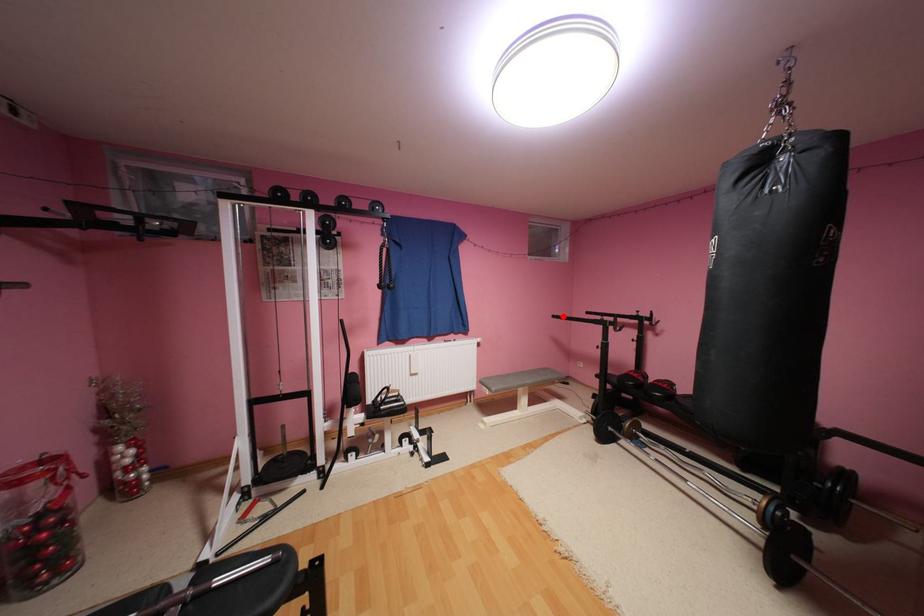
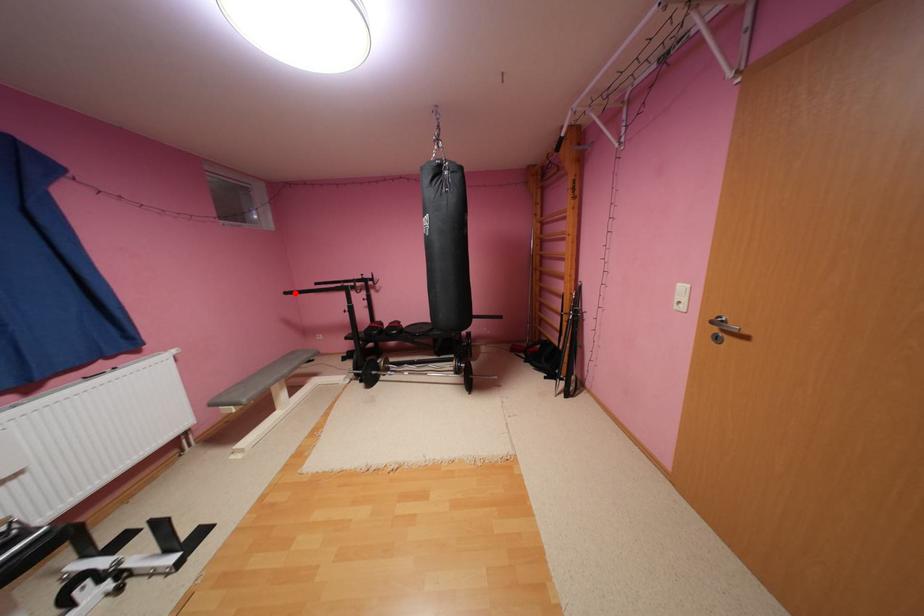
I am providing you with two images of the same scene from different viewpoints. A red point is marked on the first image and another point is marked on the second image. Do the highlighted points in image1 and image2 indicate the same real-world spot?

Yes